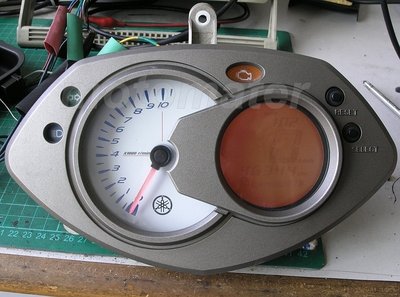
Identify the location of green board. This screenshot has width=400, height=297. (51, 244).